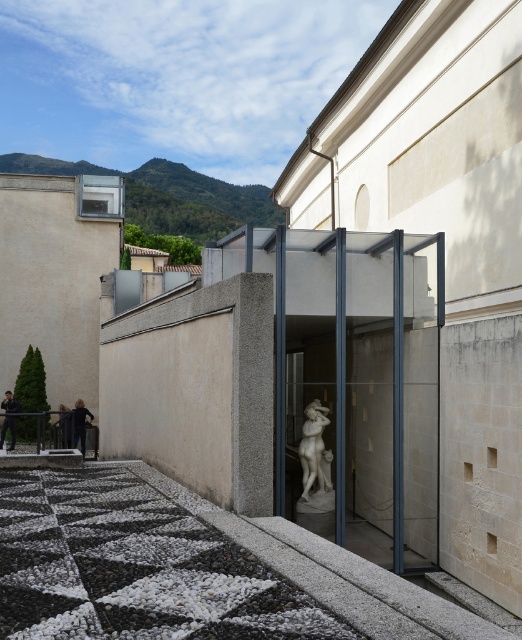
Between dark blue leather jacket at lower left and dark brown leather jacket at lower left, which one appears on the right side from the viewer's perspective?

dark brown leather jacket at lower left is more to the right.

Who is more forward, [5,410] or [68,410]?

Point [68,410] is in front.

Where is `dark blue leather jacket at lower left`? dark blue leather jacket at lower left is located at coordinates (8, 417).

Is polished marble statue at center smaller than dark brown leather jacket at lower left?

Incorrect, polished marble statue at center is not smaller in size than dark brown leather jacket at lower left.

Describe the element at coordinates (314, 451) in the screenshot. I see `polished marble statue at center` at that location.

Where is `polished marble statue at center`? The height and width of the screenshot is (640, 522). polished marble statue at center is located at coordinates (314, 451).

Is polished marble statue at center thinner than dark blue fabric at lower left?

No, polished marble statue at center is not thinner than dark blue fabric at lower left.

Does polished marble statue at center have a greater width compared to dark blue fabric at lower left?

Indeed, polished marble statue at center has a greater width compared to dark blue fabric at lower left.

Does point (321, 449) lie behind point (74, 436)?

No, it is not.

Locate an element on the screen. The image size is (522, 640). polished marble statue at center is located at coordinates (314, 451).